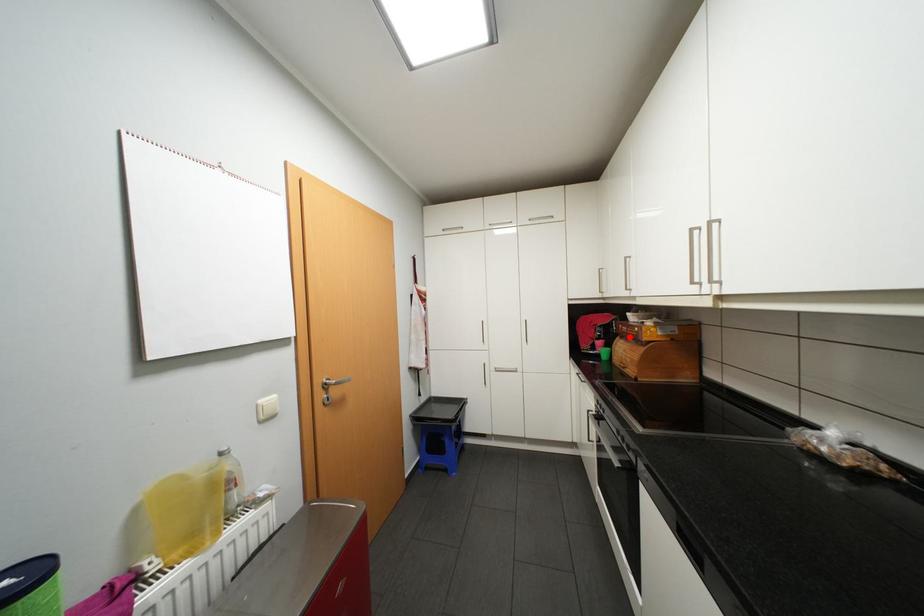
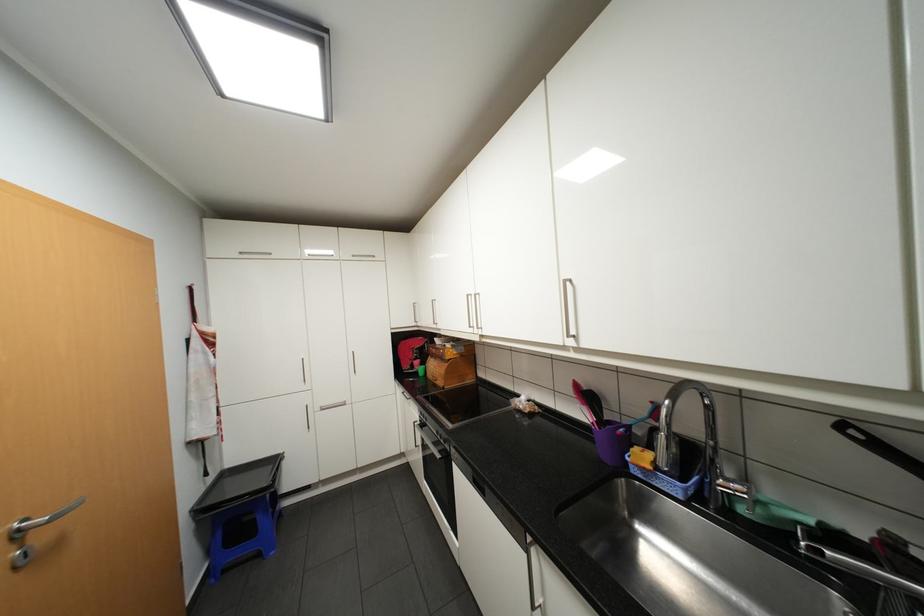
The point at the highlighted location is marked in the first image. Where is the corresponding point in the second image?

(440, 355)